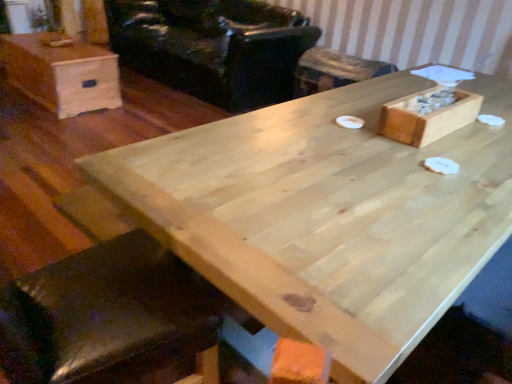
Image resolution: width=512 pixels, height=384 pixels. Describe the element at coordinates (62, 73) in the screenshot. I see `light brown wood box at upper left` at that location.

The width and height of the screenshot is (512, 384). I want to click on wooden bar stool at center, so click(x=334, y=70).

What is the approximate width of black leather armchair at upper center?

black leather armchair at upper center is 1.16 meters wide.

What are the coordinates of `light brown wood box at upper left` in the screenshot? It's located at (62, 73).

Considering the sizes of black leather armchair at upper center and natural wood table at center in the image, is black leather armchair at upper center taller or shorter than natural wood table at center?

In the image, black leather armchair at upper center appears to be taller than natural wood table at center.

Which of these two, black leather armchair at upper center or natural wood table at center, is smaller?

Smaller between the two is natural wood table at center.

Between black leather armchair at upper center and natural wood table at center, which one is positioned in front?

natural wood table at center is closer to the camera.

Does black leather armchair at upper center touch natural wood table at center?

black leather armchair at upper center and natural wood table at center are not in contact.

From a real-world perspective, is wooden bar stool at center below natural wood table at center?

Yes, from a real-world perspective, wooden bar stool at center is beneath natural wood table at center.

Is wooden bar stool at center positioned with its back to natural wood table at center?

No, wooden bar stool at center is not facing away from natural wood table at center.

Is wooden bar stool at center positioned behind natural wood table at center?

That is True.

Which of these two, wooden bar stool at center or natural wood table at center, is thinner?

wooden bar stool at center.

Is black leather armchair at upper center at the left side of light brown wood box at upper left?

In fact, black leather armchair at upper center is to the right of light brown wood box at upper left.

How much distance is there between black leather armchair at upper center and light brown wood box at upper left?

black leather armchair at upper center is 1.04 meters away from light brown wood box at upper left.

Who is taller, black leather armchair at upper center or light brown wood box at upper left?

Standing taller between the two is black leather armchair at upper center.

Considering their positions, is black leather armchair at upper center located in front of or behind light brown wood box at upper left?

Clearly, black leather armchair at upper center is behind light brown wood box at upper left.

From a real-world perspective, between wooden bar stool at center and light brown wood box at upper left, who is vertically higher?

wooden bar stool at center.

Which of these two, wooden bar stool at center or light brown wood box at upper left, is smaller?

With smaller size is wooden bar stool at center.

The height and width of the screenshot is (384, 512). I want to click on bar stool below the light brown wood box at upper left (from the image's perspective), so click(334, 70).

Is wooden bar stool at center oriented away from light brown wood box at upper left?

No, wooden bar stool at center is not facing the opposite direction of light brown wood box at upper left.

Is light brown wood box at upper left wider than black leather armchair at upper center?

No.

Considering the sizes of light brown wood box at upper left and black leather armchair at upper center in the image, is light brown wood box at upper left bigger or smaller than black leather armchair at upper center?

Considering their sizes, light brown wood box at upper left takes up less space than black leather armchair at upper center.

Does point (24, 89) come behind point (168, 44)?

No.

Is light brown wood box at upper left positioned with its back to black leather armchair at upper center?

Yes, light brown wood box at upper left's orientation is away from black leather armchair at upper center.

Considering the sizes of natural wood table at center and wooden bar stool at center in the image, is natural wood table at center wider or thinner than wooden bar stool at center?

Considering their sizes, natural wood table at center looks broader than wooden bar stool at center.

Which object is further away from the camera taking this photo, natural wood table at center or wooden bar stool at center?

Positioned behind is wooden bar stool at center.

Who is shorter, natural wood table at center or wooden bar stool at center?

With less height is wooden bar stool at center.

Is point (192, 226) closer or farther from the camera than point (352, 60)?

Point (192, 226) is positioned closer to the camera compared to point (352, 60).

Is black leather armchair at upper center turned away from wooden bar stool at center?

No, black leather armchair at upper center is not facing away from wooden bar stool at center.

Based on their sizes in the image, would you say black leather armchair at upper center is bigger or smaller than wooden bar stool at center?

Considering their sizes, black leather armchair at upper center takes up more space than wooden bar stool at center.

From the image's perspective, would you say black leather armchair at upper center is shown under wooden bar stool at center?

Actually, black leather armchair at upper center appears above wooden bar stool at center in the image.

Is black leather armchair at upper center wider or thinner than wooden bar stool at center?

black leather armchair at upper center is wider than wooden bar stool at center.

This screenshot has width=512, height=384. What are the coordinates of `table lying in front of the black leather armchair at upper center` in the screenshot? It's located at (321, 215).

In the image, there is a wooden bar stool at center. Identify the location of table below it (from the image's perspective). (321, 215).

From the image, which object appears to be farther from light brown wood box at upper left, black leather armchair at upper center or wooden bar stool at center?

wooden bar stool at center is positioned further to the anchor light brown wood box at upper left.

Looking at the image, which one is located closer to natural wood table at center, light brown wood box at upper left or wooden bar stool at center?

wooden bar stool at center is closer to natural wood table at center.

Looking at the image, which one is located closer to black leather armchair at upper center, wooden bar stool at center or natural wood table at center?

wooden bar stool at center.

From the image, which object appears to be nearer to wooden box at upper right, light brown wood box at upper left or wooden bar stool at center?

Among the two, wooden bar stool at center is located nearer to wooden box at upper right.

From the image, which object appears to be nearer to light brown wood box at upper left, natural wood table at center or black leather armchair at upper center?

black leather armchair at upper center.

Estimate the real-world distances between objects in this image. Which object is further from black leather armchair at upper center, wooden box at upper right or wooden bar stool at center?

wooden box at upper right is further to black leather armchair at upper center.

Which object lies nearer to the anchor point natural wood table at center, black leather armchair at upper center or wooden bar stool at center?

wooden bar stool at center.

From the image, which object appears to be farther from natural wood table at center, light brown wood box at upper left or black leather armchair at upper center?

Among the two, light brown wood box at upper left is located further to natural wood table at center.

The height and width of the screenshot is (384, 512). Find the location of `armchair between light brown wood box at upper left and wooden bar stool at center from left to right`. armchair between light brown wood box at upper left and wooden bar stool at center from left to right is located at coordinates (214, 47).

In order to click on storage box between light brown wood box at upper left and wooden bar stool at center in the horizontal direction in this screenshot , I will do `click(426, 116)`.

The width and height of the screenshot is (512, 384). Identify the location of storage box located between natural wood table at center and wooden bar stool at center in the depth direction. (426, 116).

Locate an element on the screen. This screenshot has height=384, width=512. bar stool positioned between wooden box at upper right and black leather armchair at upper center from near to far is located at coordinates (334, 70).